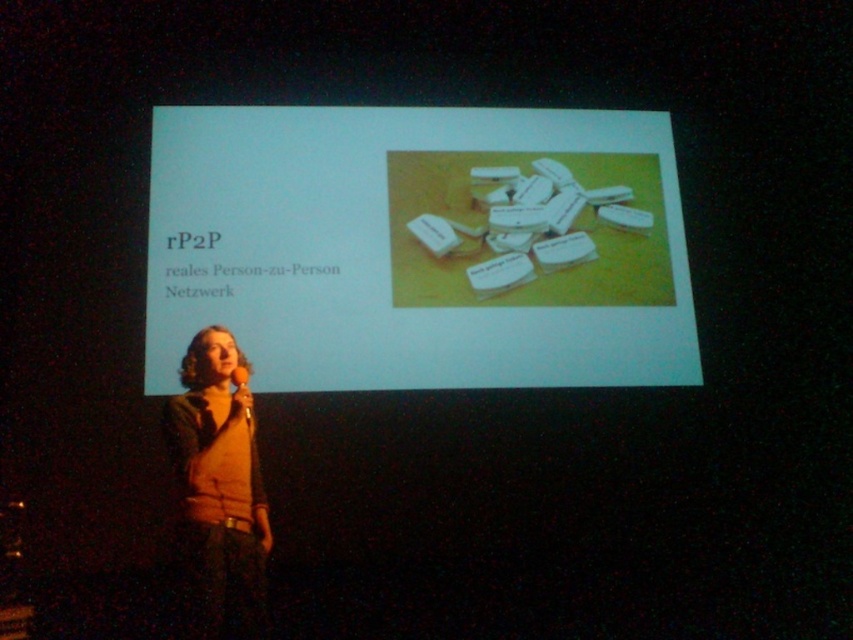
Question: Which point is closer to the camera taking this photo?

Choices:
 (A) (660, 257)
 (B) (186, 516)

Answer: (B)

Question: Does white paper at upper center lie behind matte orange sweater at center?

Choices:
 (A) no
 (B) yes

Answer: (B)

Question: Which of the following is the farthest from the observer?

Choices:
 (A) (204, 547)
 (B) (331, 230)

Answer: (B)

Question: Among these points, which one is nearest to the camera?

Choices:
 (A) (154, 141)
 (B) (231, 536)

Answer: (B)

Question: Is the position of white paper at upper center less distant than that of matte orange sweater at center?

Choices:
 (A) no
 (B) yes

Answer: (A)

Question: Is white paper at upper center smaller than matte orange sweater at center?

Choices:
 (A) yes
 (B) no

Answer: (B)